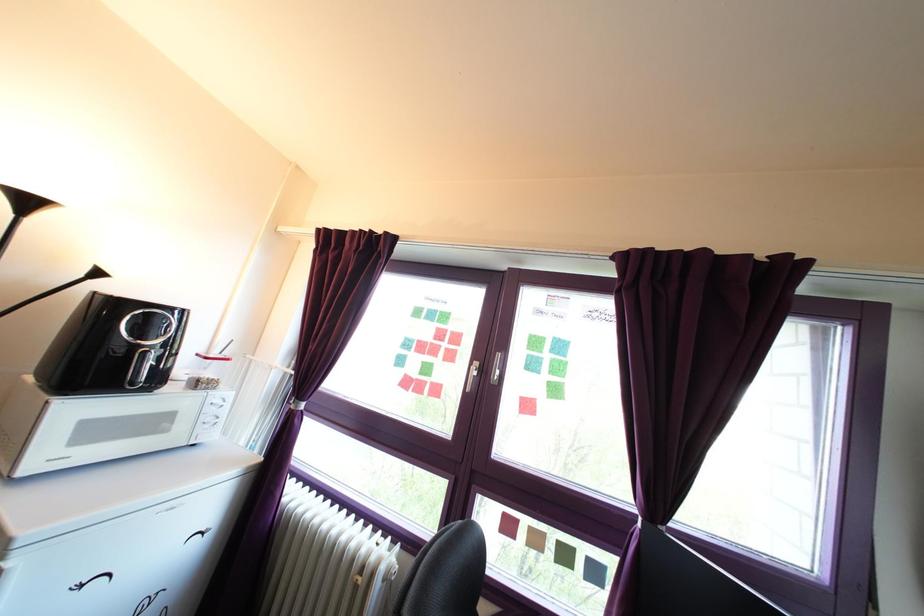
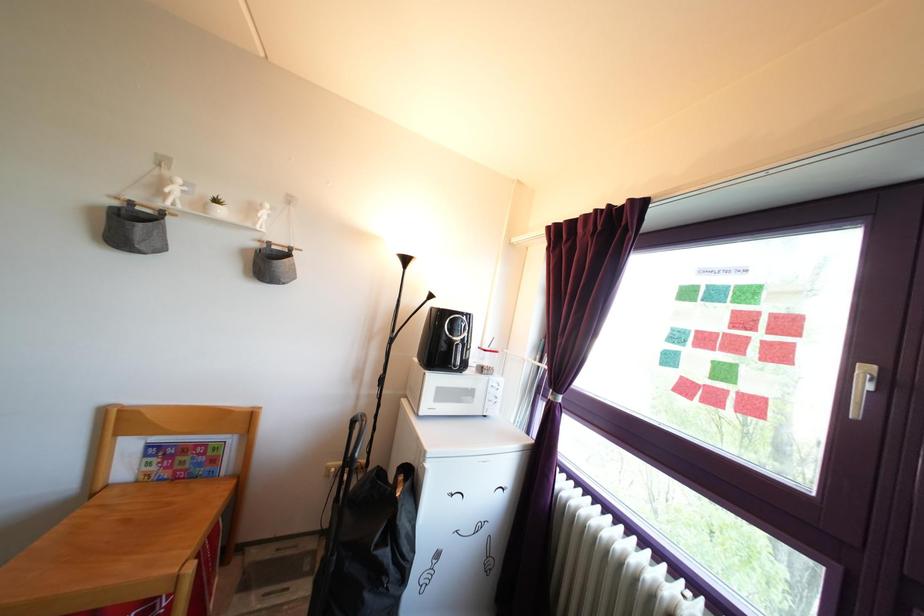
The point at (447, 354) is marked in the first image. Where is the corresponding point in the second image?

(761, 345)